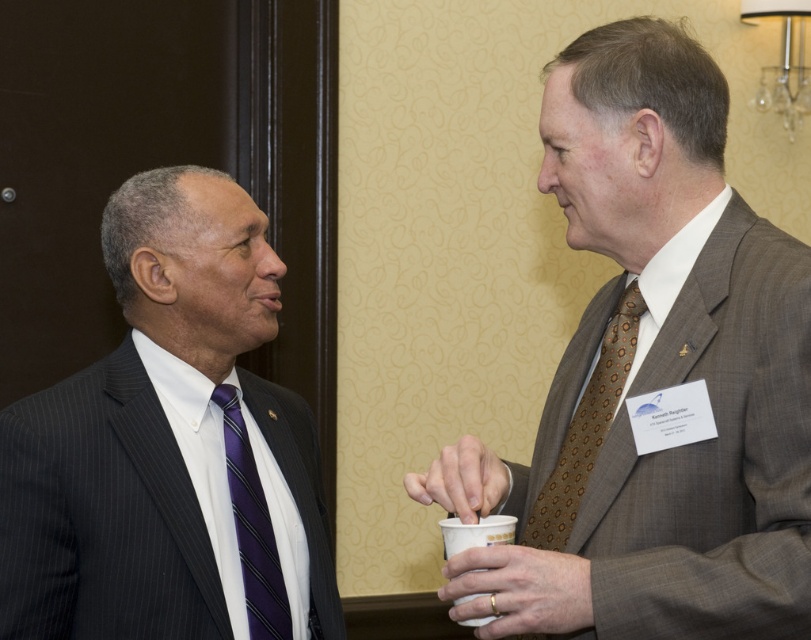
You are a photographer at a formal event. You need to take a closeup photo of the matte black suit at left and the purple striped tie at left. What is the minimum distance you should set your camera to focus on to capture both clearly?

The minimum distance should be set to 13.00 centimeters because the matte black suit at left is 13.00 centimeters away from the purple striped tie at left, ensuring both are in focus.

You are a photographer at a corporate event. You need to capture a closeup shot of the brown textured tie at right and the matte plastic cup at center without any objects in between. Is the distance between them sufficient for your camera lens with a 10 inch focal length to focus properly?

The distance between the brown textured tie at right and the matte plastic cup at center is 10.79 inches. Since the required focal length is 10 inches, the camera can focus properly as the distance is slightly more than needed.